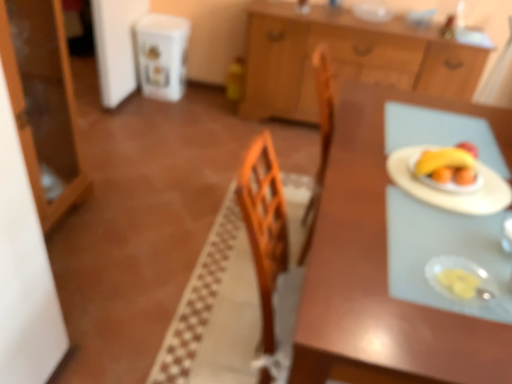
At what (x,y) coordinates should I click in order to perform the action: click on vacant area in front of yellow matte bananas at right. Please return your answer as a coordinate pair (x, y). This screenshot has width=512, height=384. Looking at the image, I should click on (458, 193).